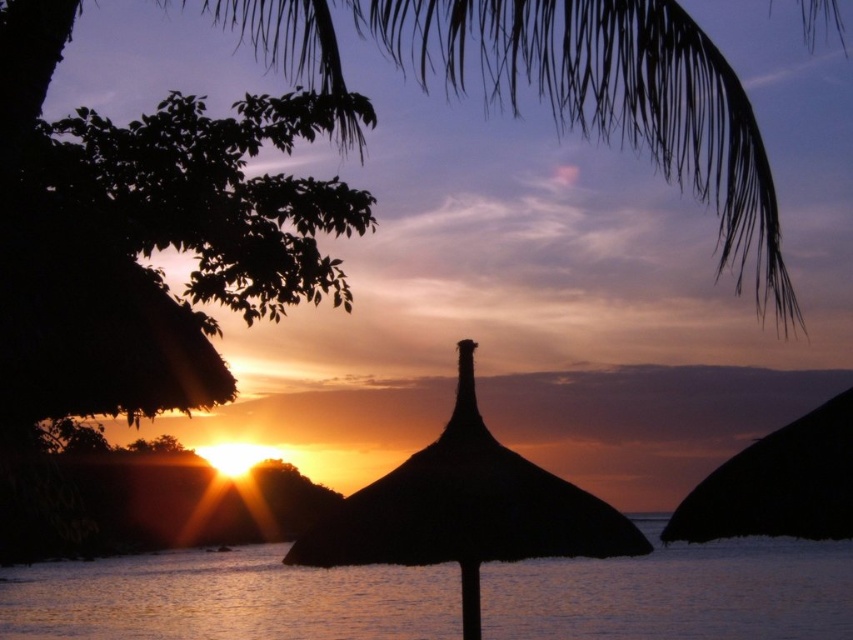
You are a photographer trying to capture the sunset. You notice the glistening water at center and the black straw umbrella at center in your viewfinder. Which object should you adjust your camera to focus on if you want to highlight the sunset reflection first?

You should focus on the glistening water at center first because it is positioned to the left of the black straw umbrella at center, making it closer to the sunset reflection area.